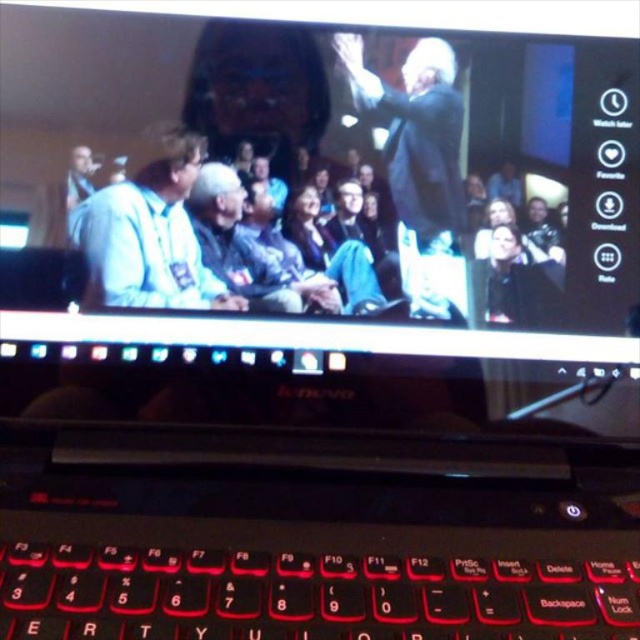
Question: Considering the relative positions of dark gray suit at upper center and black matte jacket at lower right in the image provided, where is dark gray suit at upper center located with respect to black matte jacket at lower right?

Choices:
 (A) left
 (B) right

Answer: (A)

Question: Is dark gray suit at upper center closer to camera compared to black matte jacket at lower right?

Choices:
 (A) no
 (B) yes

Answer: (B)

Question: Among these points, which one is farthest from the camera?

Choices:
 (A) (605, 566)
 (B) (496, 227)
 (C) (428, 168)

Answer: (B)

Question: Which of the following is the farthest from the observer?

Choices:
 (A) black matte jacket at lower right
 (B) black plastic keyboard at bottom
 (C) light blue fabric shirt at left

Answer: (A)

Question: In this image, where is black plastic keyboard at bottom located relative to light blue fabric shirt at left?

Choices:
 (A) left
 (B) right

Answer: (B)

Question: Which object is farther from the camera taking this photo?

Choices:
 (A) black matte jacket at lower right
 (B) light blue fabric shirt at left
 (C) dark gray suit at upper center
 (D) black plastic keyboard at bottom

Answer: (A)